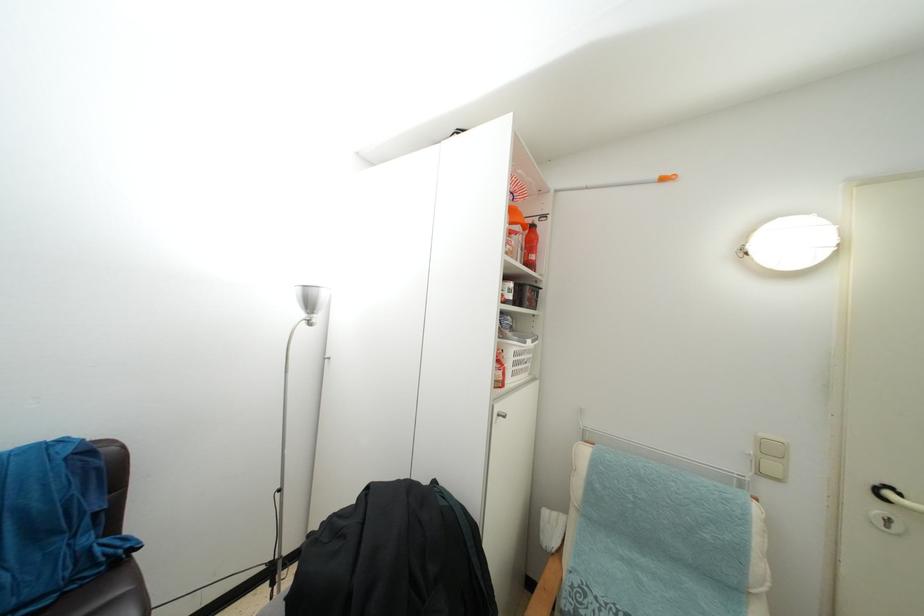
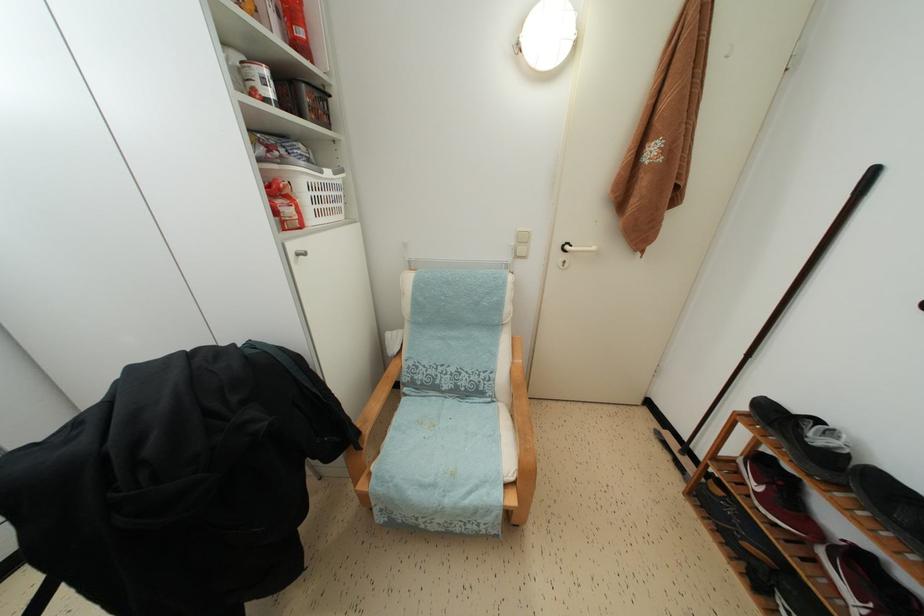
Where in the second image is the point corresponding to (519,370) from the first image?

(319, 206)